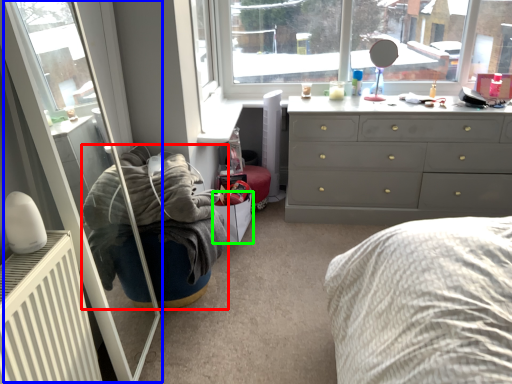
Question: Which object is positioned closest to bean bag chair (highlighted by a red box)? Select from screen door (highlighted by a blue box) and shoe box (highlighted by a green box).

Choices:
 (A) screen door
 (B) shoe box

Answer: (A)